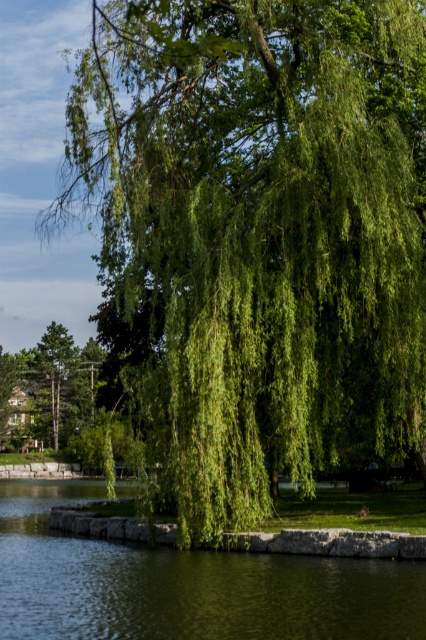
Is point (405, 602) positioned before point (14, 428)?

That is True.

Is point (264, 604) positioned behind point (66, 360)?

That is False.

Is point (287, 620) positioned after point (54, 442)?

No, (287, 620) is in front of (54, 442).

What are the coordinates of `green liquid water at lower left` in the screenshot? It's located at (186, 584).